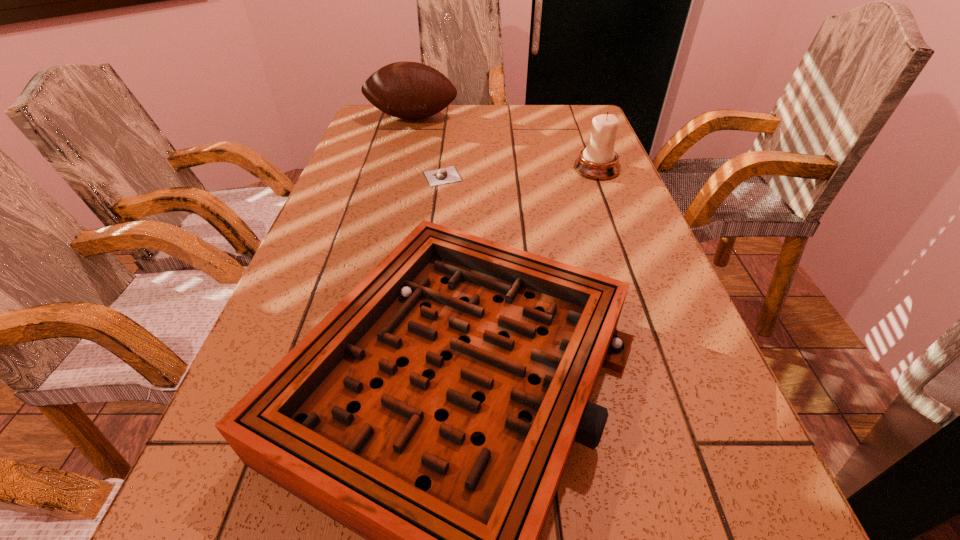
At what (x,y) coordinates should I click in order to perform the action: click on football. Please return your answer as a coordinate pair (x, y). The height and width of the screenshot is (540, 960). Looking at the image, I should click on (408, 90).

Identify the location of candle holder. (599, 161).

Identify the location of garlic. This screenshot has height=540, width=960. (447, 175).

Image resolution: width=960 pixels, height=540 pixels. What are the coordinates of `free location located on the laces of the football` in the screenshot? It's located at (392, 195).

Where is `free space located 0.350m on the back of the candle holder`? This screenshot has height=540, width=960. free space located 0.350m on the back of the candle holder is located at coordinates (574, 110).

The image size is (960, 540). What are the coordinates of `vacant region located on the right of the shortest object` in the screenshot? It's located at (552, 177).

Locate an element on the screen. This screenshot has height=540, width=960. object positioned at the far edge is located at coordinates (408, 90).

This screenshot has height=540, width=960. I want to click on object positioned at the left edge, so [x=408, y=90].

The height and width of the screenshot is (540, 960). Find the location of `object that is at the right edge`. object that is at the right edge is located at coordinates (599, 161).

This screenshot has height=540, width=960. Find the location of `object at the far left corner`. object at the far left corner is located at coordinates (408, 90).